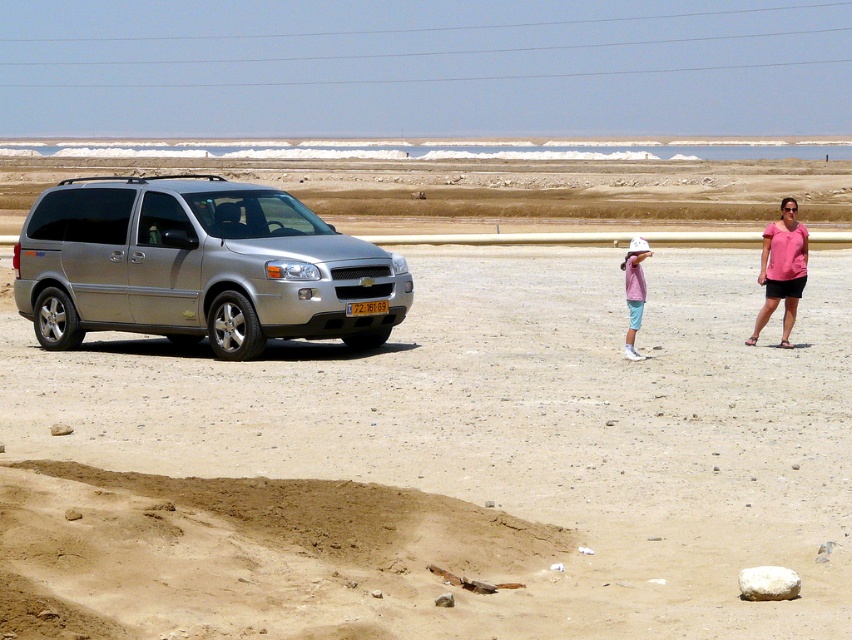
Does point (298, 266) lie in front of point (786, 214)?

Yes, it is.

Between silver metallic minivan at left and pink fabric shirt at right, which one is positioned higher?

pink fabric shirt at right is higher up.

Is point (148, 276) more distant than point (769, 225)?

No, it is in front of (769, 225).

The width and height of the screenshot is (852, 640). I want to click on silver metallic minivan at left, so click(x=199, y=266).

Does sandy beige at left have a greater height compared to silver metallic minivan at left?

Indeed, sandy beige at left has a greater height compared to silver metallic minivan at left.

Who is positioned more to the left, sandy beige at left or silver metallic minivan at left?

silver metallic minivan at left is more to the left.

Who is more forward, (x=137, y=403) or (x=214, y=292)?

Point (x=137, y=403)

I want to click on sandy beige at left, so click(444, 465).

Which of these two, silver metallic minivan at left or pink fabric shirt at center, stands shorter?

Standing shorter between the two is pink fabric shirt at center.

Which is above, silver metallic minivan at left or pink fabric shirt at center?

Positioned higher is silver metallic minivan at left.

Between point (154, 195) and point (630, 285), which one is positioned behind?

The point (154, 195) is more distant.

Locate an element on the screen. The height and width of the screenshot is (640, 852). silver metallic minivan at left is located at coordinates (199, 266).